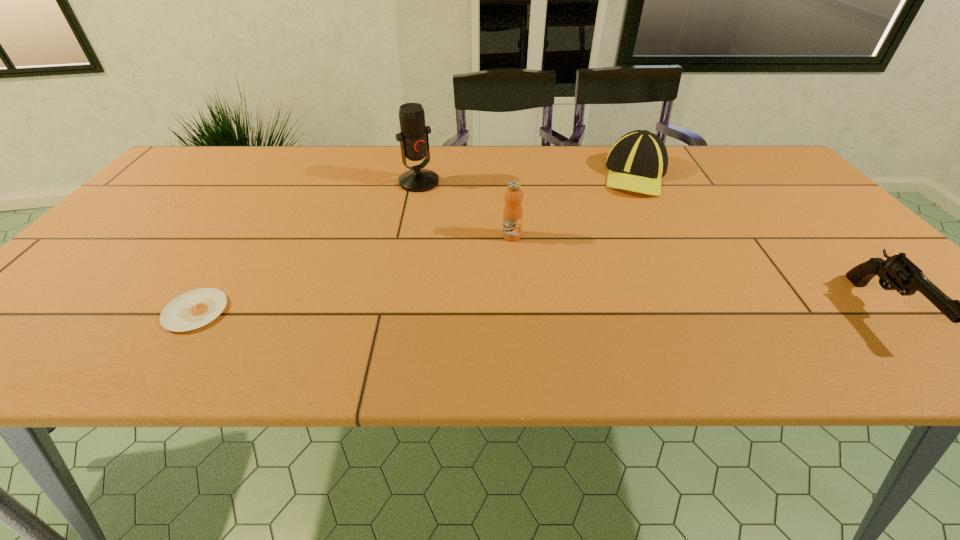
Find the location of `blank space located on the front label of the second tallest object`. blank space located on the front label of the second tallest object is located at coordinates (517, 285).

Locate an element on the screen. vacant space located on the front label of the second tallest object is located at coordinates (516, 275).

Locate an element on the screen. The height and width of the screenshot is (540, 960). vacant space located on the side of the microphone with the red ring is located at coordinates (443, 204).

The height and width of the screenshot is (540, 960). Identify the location of vacant point located on the side of the microphone with the red ring. (478, 239).

Find the location of a particular element. Image resolution: width=960 pixels, height=540 pixels. free point located 0.310m on the side of the microphone with the red ring is located at coordinates (490, 250).

This screenshot has width=960, height=540. What are the coordinates of `vacant space located 0.280m with the brim of the baseball cap facing forward` in the screenshot? It's located at (594, 252).

Locate an element on the screen. The image size is (960, 540). free spot located with the brim of the baseball cap facing forward is located at coordinates (607, 232).

The height and width of the screenshot is (540, 960). I want to click on free region located 0.290m with the brim of the baseball cap facing forward, so click(x=592, y=254).

Where is `microphone that is at the far edge`? This screenshot has width=960, height=540. microphone that is at the far edge is located at coordinates (414, 142).

At what (x,y) coordinates should I click in order to perform the action: click on baseball cap located at the far edge. Please return your answer as a coordinate pair (x, y). The height and width of the screenshot is (540, 960). Looking at the image, I should click on (637, 161).